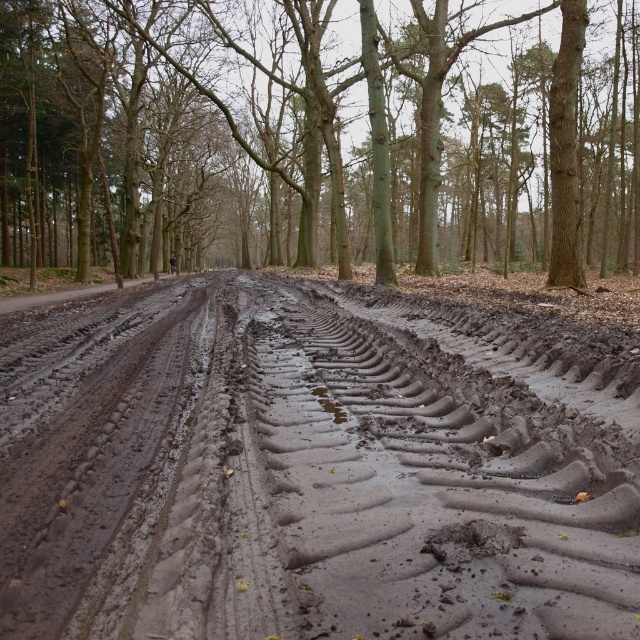
Can you confirm if muddy rubber tire tracks at center is positioned to the right of brown smooth tree at center?

Yes, muddy rubber tire tracks at center is to the right of brown smooth tree at center.

Consider the image. Can you confirm if muddy rubber tire tracks at center is shorter than brown smooth tree at center?

Yes.

Who is more distant from viewer, (x=42, y=554) or (x=246, y=236)?

The point (x=246, y=236) is behind.

Find the location of a particular element. Image resolution: width=640 pixels, height=640 pixels. muddy rubber tire tracks at center is located at coordinates (312, 468).